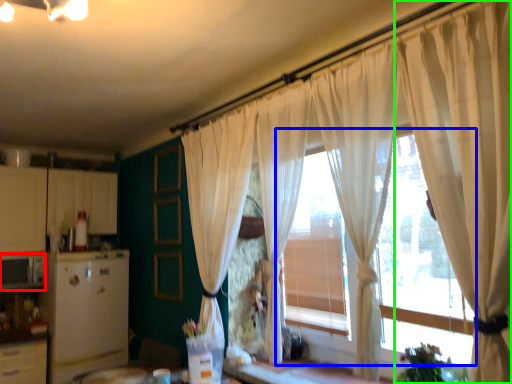
Question: Which object is the closest to the appliance (highlighted by a red box)? Choose among these: window frame (highlighted by a blue box) or curtain (highlighted by a green box).

Choices:
 (A) window frame
 (B) curtain

Answer: (A)